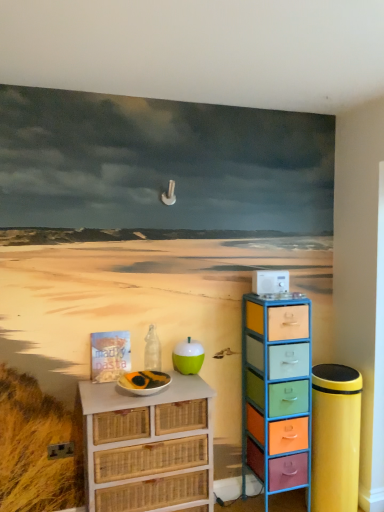
Question: Is point (304, 419) closer or farther from the camera than point (114, 502)?

Choices:
 (A) farther
 (B) closer

Answer: (A)

Question: Is multicolored plastic drawers at right, the first chest of drawers when ordered from right to left, bigger or smaller than white wicker chest of drawers at lower left, which is the first chest of drawers from left to right?

Choices:
 (A) small
 (B) big

Answer: (A)

Question: Estimate the real-world distances between objects in this image. Which object is closer to the white wicker chest of drawers at lower left, the second chest of drawers from the right?

Choices:
 (A) transparent glass bottle at center
 (B) teal glossy apple at center
 (C) multicolored plastic drawers at right, the first chest of drawers when ordered from right to left

Answer: (B)

Question: Considering the real-world distances, which object is closest to the multicolored plastic drawers at right, which is counted as the second chest of drawers, starting from the left?

Choices:
 (A) white wicker chest of drawers at lower left, the second chest of drawers from the right
 (B) teal glossy apple at center
 (C) transparent glass bottle at center

Answer: (B)